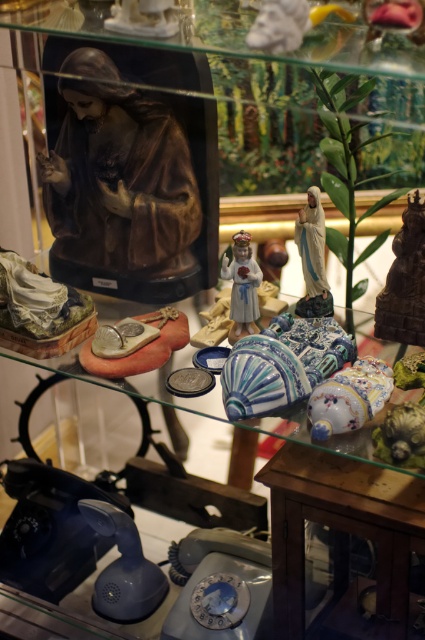
Which is below, wooden cabinet at lower right or porcelain figurine at center?

Positioned lower is wooden cabinet at lower right.

What do you see at coordinates (342, 538) in the screenshot? The image size is (425, 640). I see `wooden cabinet at lower right` at bounding box center [342, 538].

You are a GUI agent. You are given a task and a screenshot of the screen. Output one action in this format:
    pyautogui.click(x=<x>, y=<y>)
    Task: Click on the wooden cabinet at lower right
    This screenshot has width=425, height=640.
    Given the screenshot: What is the action you would take?
    pyautogui.click(x=342, y=538)

Who is shorter, matte brown statue at upper left or matte gold statue at right?

matte gold statue at right

Where is `matte brown statue at upper left`? matte brown statue at upper left is located at coordinates (119, 188).

The image size is (425, 640). What do you see at coordinates (119, 188) in the screenshot?
I see `matte brown statue at upper left` at bounding box center [119, 188].

The image size is (425, 640). Find the location of `matte brown statue at upper left`. matte brown statue at upper left is located at coordinates (119, 188).

I want to click on matte gold statue at right, so click(x=405, y=282).